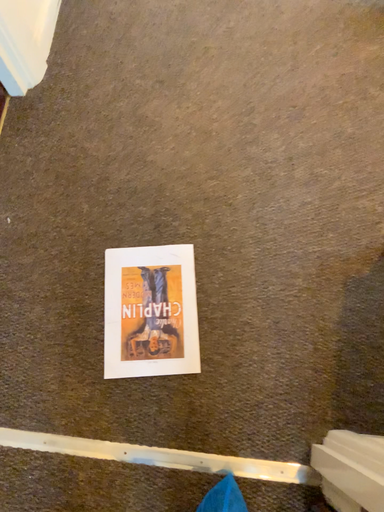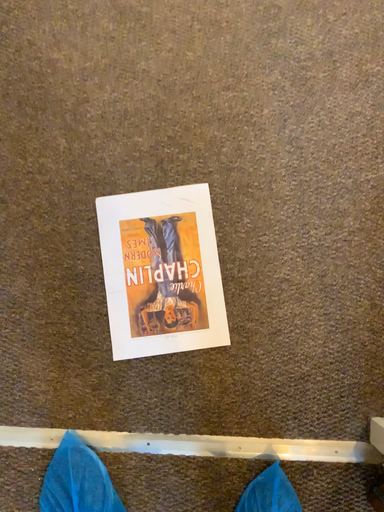
Question: How did the camera likely rotate when shooting the video?

Choices:
 (A) rotated upward
 (B) rotated downward

Answer: (B)